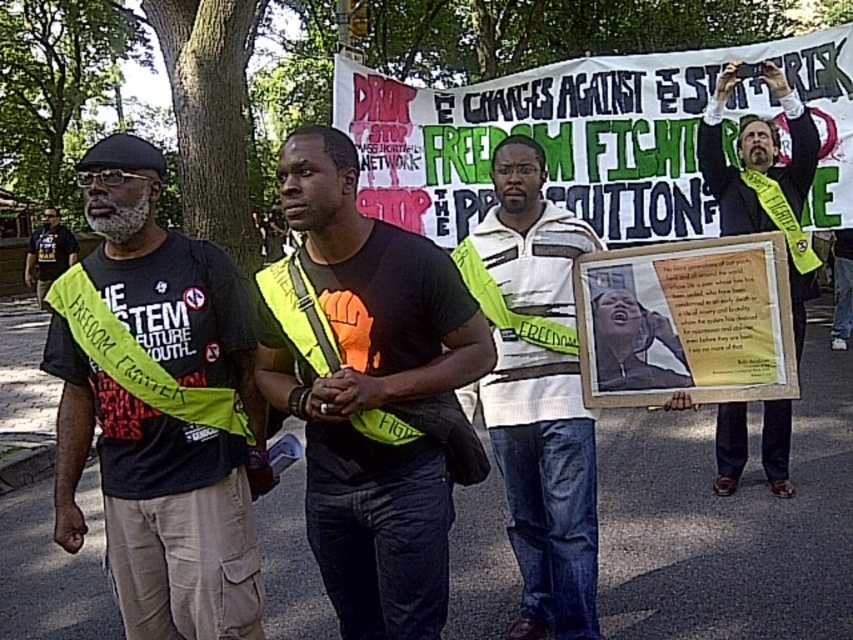
Between white striped sweater at center and matte black t-shirt at left, which one appears on the left side from the viewer's perspective?

Positioned to the left is matte black t-shirt at left.

Is white striped sweater at center to the left of matte black t-shirt at left from the viewer's perspective?

Incorrect, white striped sweater at center is not on the left side of matte black t-shirt at left.

Which is behind, point (518, 536) or point (30, 237)?

Point (30, 237)

Where is `white striped sweater at center`? The width and height of the screenshot is (853, 640). white striped sweater at center is located at coordinates (537, 392).

Does point (172, 308) lie behind point (757, 173)?

No, it is not.

Who is positioned more to the right, neon yellow sash at left or yellow fabric sash at right?

From the viewer's perspective, yellow fabric sash at right appears more on the right side.

The width and height of the screenshot is (853, 640). I want to click on neon yellow sash at left, so click(161, 412).

Does black fabric t-shirt at center have a lesser width compared to white striped sweater at center?

No.

Consider the image. Is black fabric t-shirt at center further to the viewer compared to white striped sweater at center?

No, it is not.

Identify the location of black fabric t-shirt at center. The image size is (853, 640). (370, 390).

This screenshot has height=640, width=853. Find the location of `black fabric t-shirt at center`. black fabric t-shirt at center is located at coordinates (370, 390).